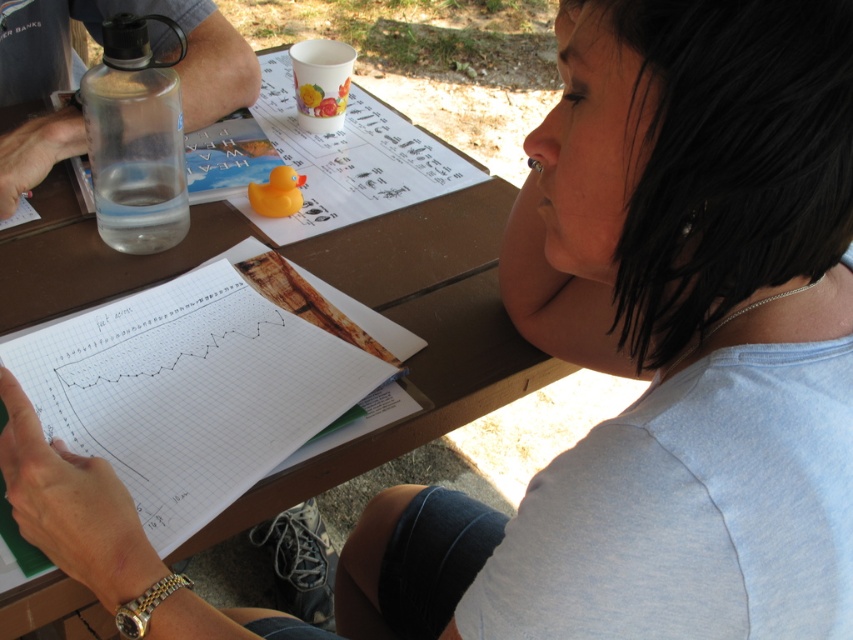
Is brown wooden picnic table at center wider than transparent plastic water bottle at left?

Yes, brown wooden picnic table at center is wider than transparent plastic water bottle at left.

Is brown wooden picnic table at center taller than transparent plastic water bottle at left?

Yes, brown wooden picnic table at center is taller than transparent plastic water bottle at left.

Who is more forward, (434, 397) or (38, 131)?

Point (434, 397) is in front.

Locate an element on the screen. The width and height of the screenshot is (853, 640). brown wooden picnic table at center is located at coordinates (415, 332).

What are the coordinates of `white grid paper at center` in the screenshot? It's located at click(x=189, y=388).

The image size is (853, 640). Identify the location of white grid paper at center. point(189,388).

Looking at this image, is white grid paper at center positioned before transparent plastic water bottle at left?

Yes, white grid paper at center is closer to the viewer.

In the scene shown: Is white grid paper at center shorter than transparent plastic water bottle at left?

Indeed, white grid paper at center has a lesser height compared to transparent plastic water bottle at left.

Does point (227, 336) come behind point (3, 156)?

That is False.

At what (x,y) coordinates should I click in order to perform the action: click on white grid paper at center. Please return your answer as a coordinate pair (x, y). Image resolution: width=853 pixels, height=640 pixels. Looking at the image, I should click on (189, 388).